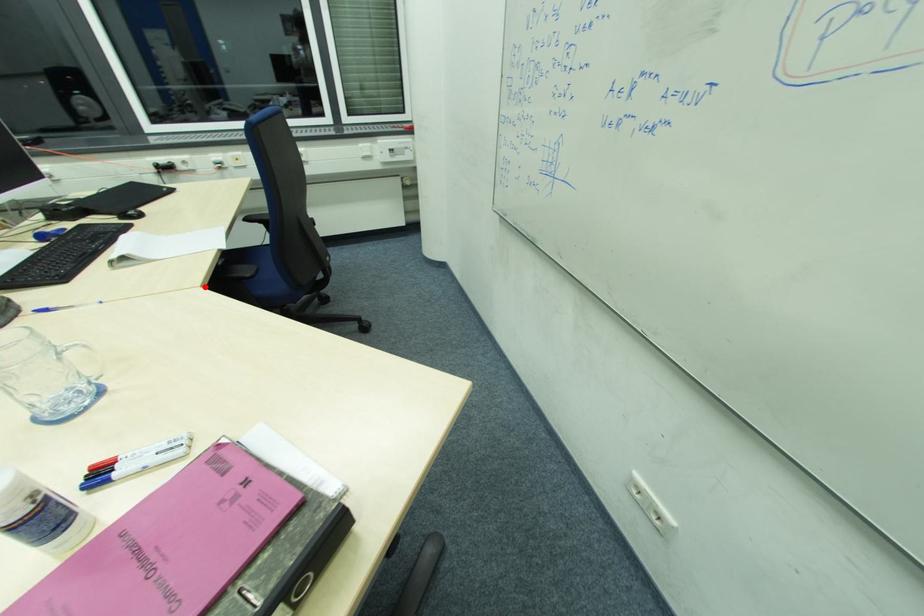
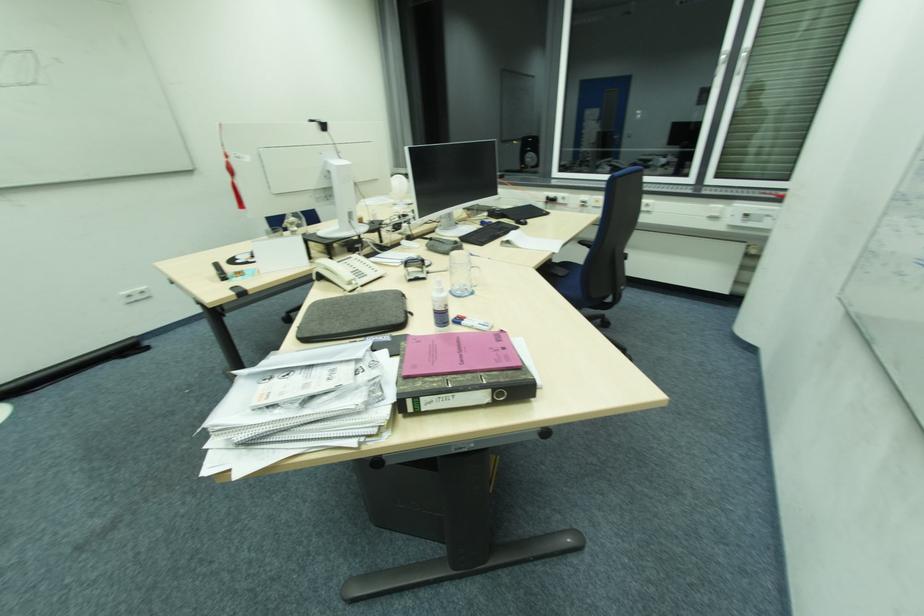
In the second image, find the point that corresponds to the highlighted location in the first image.

(539, 268)